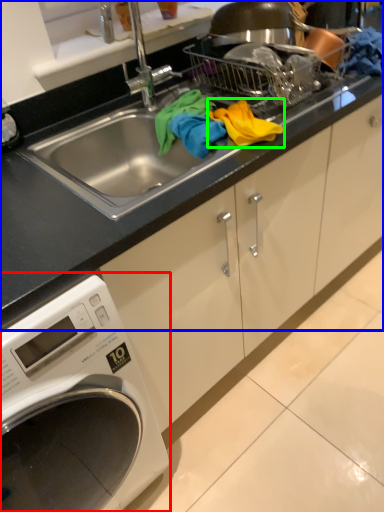
Question: Which object is positioned closest to washing machine (highlighted by a red box)? Select from countertop (highlighted by a blue box) and material (highlighted by a green box).

Choices:
 (A) countertop
 (B) material

Answer: (A)